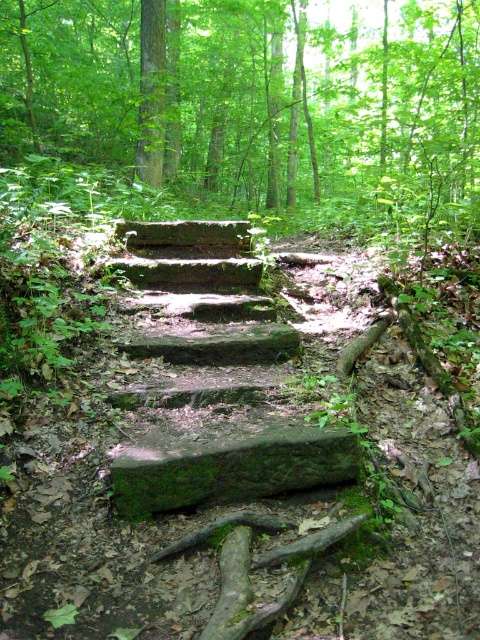
Is green mossy stone stairs at center wider than green mossy stone at center?

Yes, green mossy stone stairs at center is wider than green mossy stone at center.

Is green mossy stone stairs at center positioned behind green mossy stone at center?

Yes, green mossy stone stairs at center is further from the viewer.

Image resolution: width=480 pixels, height=640 pixels. What do you see at coordinates (214, 378) in the screenshot? I see `green mossy stone stairs at center` at bounding box center [214, 378].

Where is `green mossy stone stairs at center`? green mossy stone stairs at center is located at coordinates (214, 378).

Does green mossy stone steps at center appear on the left side of green mossy stone stairs at center?

Correct, you'll find green mossy stone steps at center to the left of green mossy stone stairs at center.

Does green mossy stone steps at center appear under green mossy stone stairs at center?

Actually, green mossy stone steps at center is above green mossy stone stairs at center.

What do you see at coordinates (255, 104) in the screenshot? The width and height of the screenshot is (480, 640). I see `green mossy stone steps at center` at bounding box center [255, 104].

Locate an element on the screen. This screenshot has width=480, height=640. green mossy stone steps at center is located at coordinates (255, 104).

Can you confirm if green mossy stone steps at center is positioned to the left of green mossy stone at center?

Yes, green mossy stone steps at center is to the left of green mossy stone at center.

Can you confirm if green mossy stone steps at center is wider than green mossy stone at center?

Incorrect, green mossy stone steps at center's width does not surpass green mossy stone at center's.

Is point (147, 10) closer to viewer compared to point (187, 454)?

No, (147, 10) is behind (187, 454).

Where is `green mossy stone steps at center`? green mossy stone steps at center is located at coordinates (255, 104).